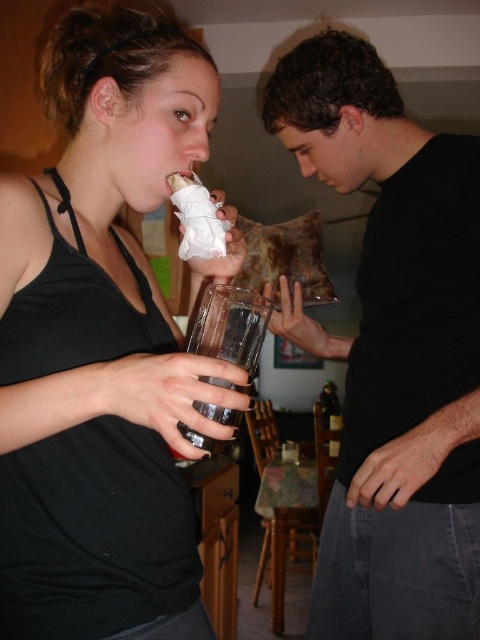
You are organizing a clothing display and need to arrange the matte black tank top at center and the black matte shirt at center in a row from left to right. According to the image, what order should they be placed in?

The matte black tank top at center should be placed to the left of the black matte shirt at center, as it is positioned to the left in the image.

You are trying to take a photo of the transparent glass at center. However, the matte black tank top at center is blocking your view. Can you move the glass to the side so you can capture it without obstruction?

The matte black tank top at center is in front of the transparent glass at center, so moving the glass to the side might help avoid the obstruction caused by the tank top.

You are a delivery robot that needs to place a small package between the black matte shirt at center and the transparent glass at center. The package is 16 inches long. Will it fit in the space between them?

The distance between the black matte shirt at center and the transparent glass at center is 17.85 inches. Since the package is 16 inches long, it will fit in the space between them as there is enough room.